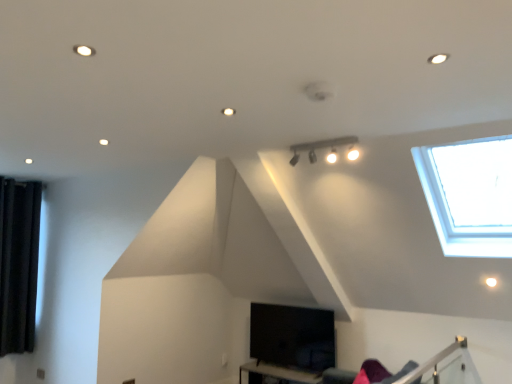
Question: From the image's perspective, is matte black track lighting at upper center on top of black matte table at lower center?

Choices:
 (A) yes
 (B) no

Answer: (A)

Question: Can you confirm if matte black track lighting at upper center is positioned to the right of black matte table at lower center?

Choices:
 (A) no
 (B) yes

Answer: (B)

Question: Can you see matte black track lighting at upper center touching black matte table at lower center?

Choices:
 (A) yes
 (B) no

Answer: (B)

Question: Is matte black track lighting at upper center thinner than black matte table at lower center?

Choices:
 (A) no
 (B) yes

Answer: (B)

Question: From a real-world perspective, is matte black track lighting at upper center over black matte table at lower center?

Choices:
 (A) no
 (B) yes

Answer: (B)

Question: Considering their positions, is black velvet curtain at left located in front of or behind matte black track lighting at upper center?

Choices:
 (A) behind
 (B) front

Answer: (A)

Question: Visually, is black velvet curtain at left positioned to the left or to the right of matte black track lighting at upper center?

Choices:
 (A) right
 (B) left

Answer: (B)

Question: From the image's perspective, relative to matte black track lighting at upper center, is black velvet curtain at left above or below?

Choices:
 (A) below
 (B) above

Answer: (A)

Question: Is black velvet curtain at left taller or shorter than matte black track lighting at upper center?

Choices:
 (A) tall
 (B) short

Answer: (A)

Question: Is black matte table at lower center inside the boundaries of matte black track lighting at upper center, or outside?

Choices:
 (A) outside
 (B) inside

Answer: (A)

Question: In the image, is black matte table at lower center on the left side or the right side of matte black track lighting at upper center?

Choices:
 (A) left
 (B) right

Answer: (A)

Question: Is point (271, 377) positioned closer to the camera than point (342, 139)?

Choices:
 (A) farther
 (B) closer

Answer: (A)

Question: Looking at their shapes, would you say black matte table at lower center is wider or thinner than matte black track lighting at upper center?

Choices:
 (A) wide
 (B) thin

Answer: (A)

Question: From the image's perspective, is black velvet curtain at left above or below black matte table at lower center?

Choices:
 (A) below
 (B) above

Answer: (B)

Question: From a real-world perspective, is black velvet curtain at left above or below black matte table at lower center?

Choices:
 (A) above
 (B) below

Answer: (A)